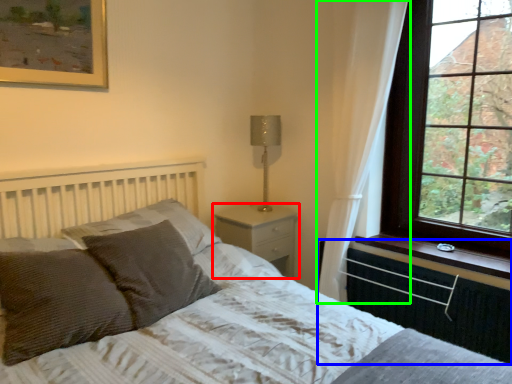
Question: Which object is the closest to the nightstand (highlighted by a red box)? Choose among these: radiator (highlighted by a blue box) or curtain (highlighted by a green box).

Choices:
 (A) radiator
 (B) curtain

Answer: (B)